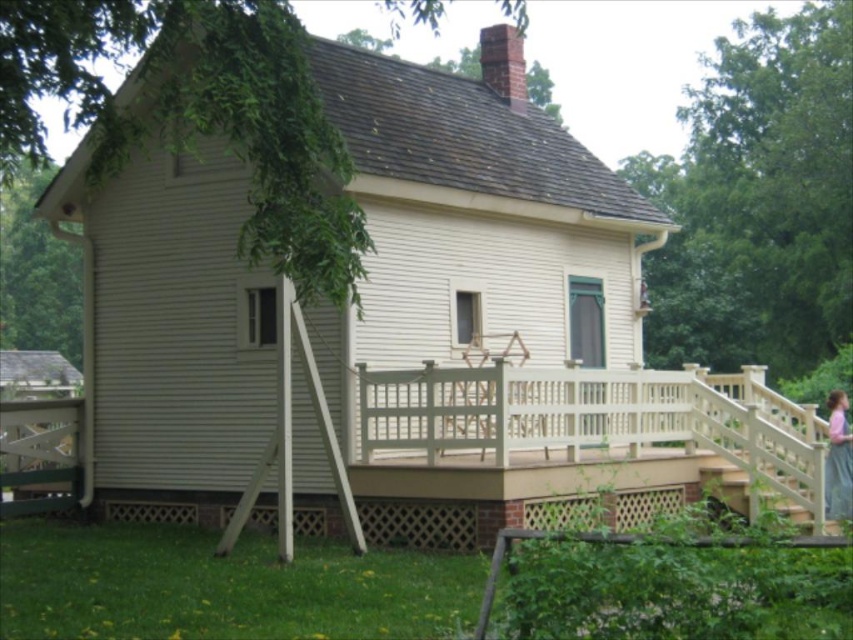
Who is lower down, white wooden stairs at lower right or pink fabric dress at upper right?

white wooden stairs at lower right is lower down.

Is white wooden stairs at lower right in front of pink fabric dress at upper right?

That is True.

Is point (747, 484) positioned after point (834, 444)?

Yes, point (747, 484) is behind point (834, 444).

Where is `white wooden stairs at lower right`? The image size is (853, 640). white wooden stairs at lower right is located at coordinates (724, 483).